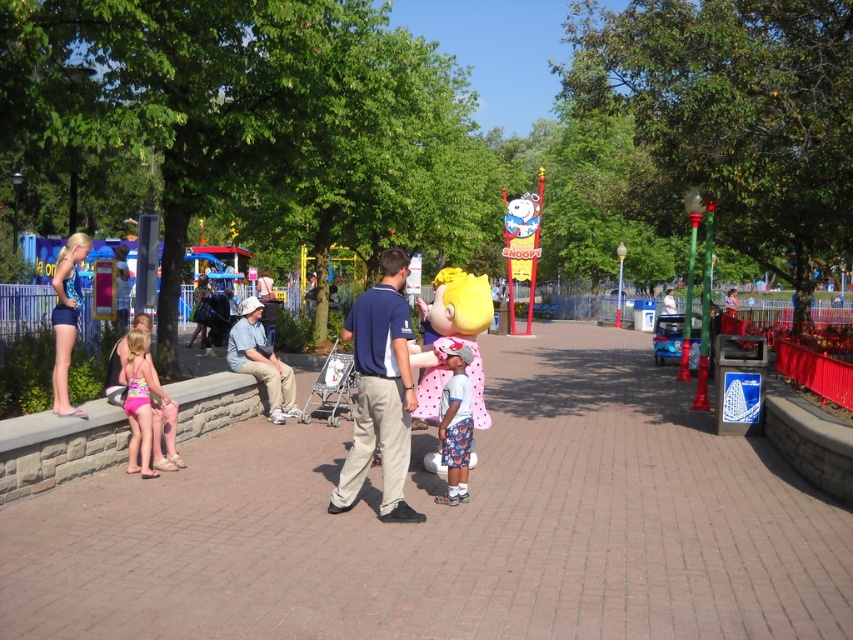
You are a photographer trying to capture both the light blue cotton shirt at center and the pink fabric swimsuit at left in a single shot. Since you want both to be clearly visible, which object should you focus on first to ensure the larger one is in sharp focus?

The light blue cotton shirt at center is bigger than the pink fabric swimsuit at left, so you should focus on the light blue cotton shirt at center first to ensure it is in sharp focus.

You are a photographer standing in the theme park scene. You need to take a photo that includes both the matte blue shirt at center and the light blue cotton shirt at center. Which shirt should you position to your right to ensure both are in the frame?

To include both the matte blue shirt at center and the light blue cotton shirt at center in the frame, you should position the matte blue shirt at center to your right since it is already located to the right of the light blue cotton shirt at center in the scene.

You are a photographer standing at the center of the scene. You want to take a group photo of the matte blue shirt at center and the pink polka dot dress at center. What is the minimum distance you should set your camera to focus on to ensure both subjects are in clear focus?

The minimum focusing distance should be set to 28.13 inches to ensure both the matte blue shirt at center and the pink polka dot dress at center are in clear focus.